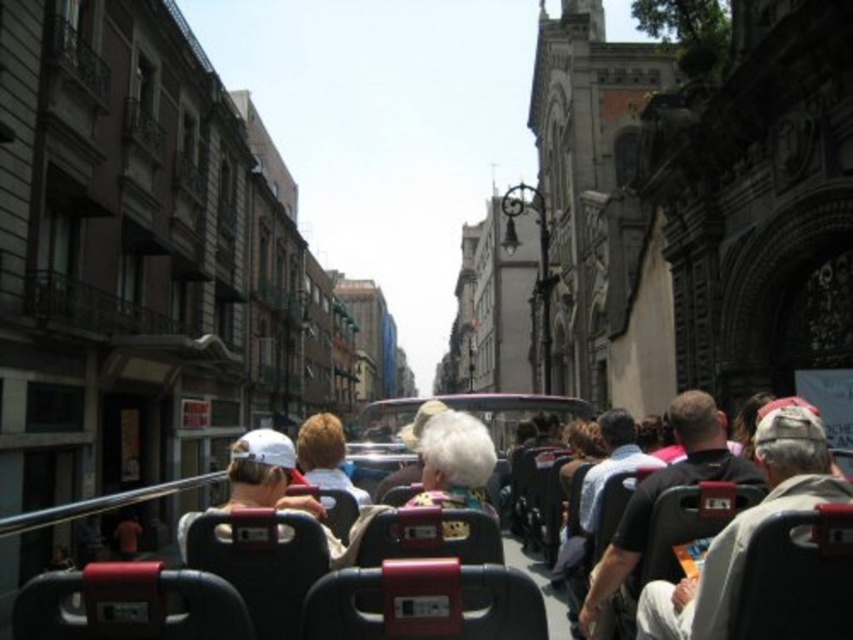
Does white fabric at center appear under black leather coach at center?

Yes.

Consider the image. Does white fabric at center lie in front of black leather coach at center?

Yes, it is in front of black leather coach at center.

Locate an element on the screen. The width and height of the screenshot is (853, 640). white fabric at center is located at coordinates (746, 525).